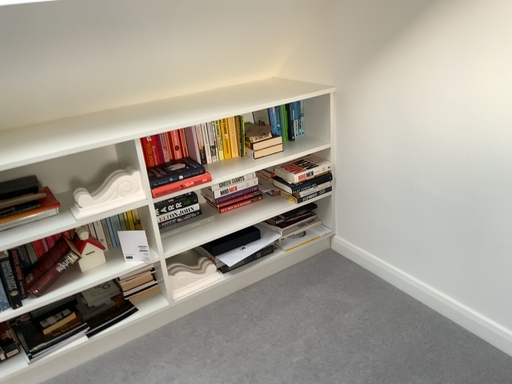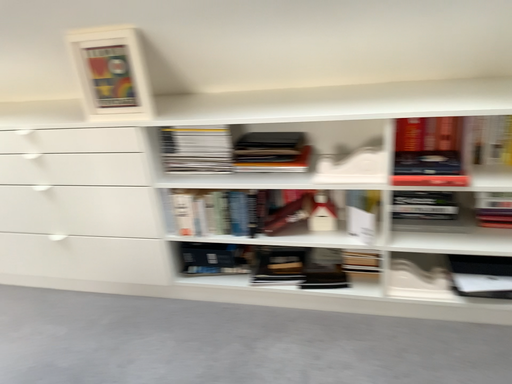
Question: Which way did the camera rotate in the video?

Choices:
 (A) rotated left
 (B) rotated right

Answer: (A)